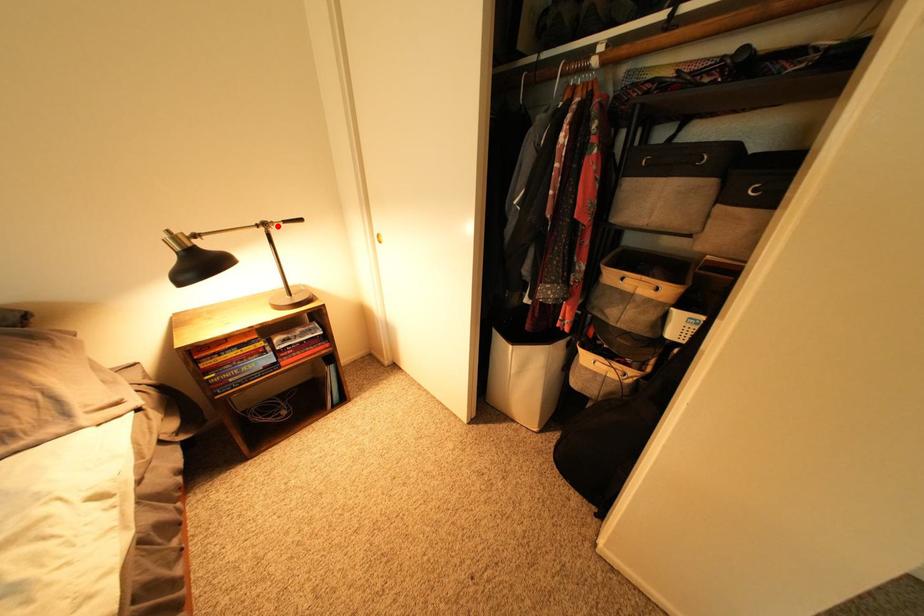
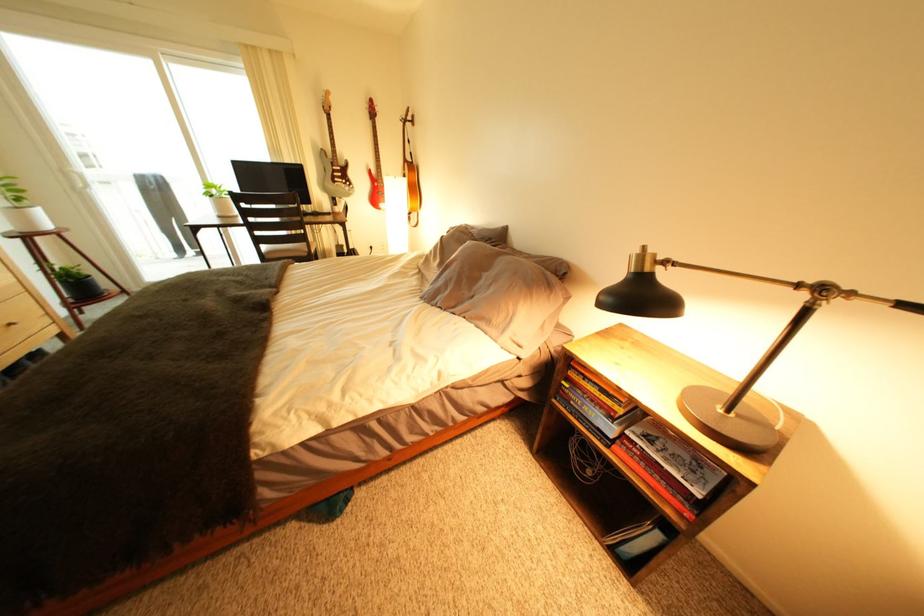
Where in the second image is the point corresponding to the highlighted location from the first image?

(834, 291)